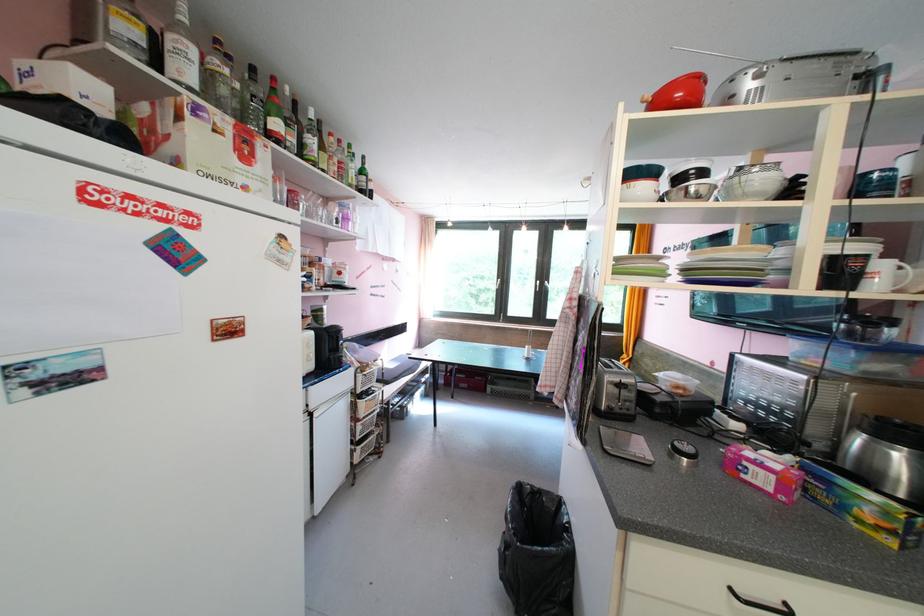
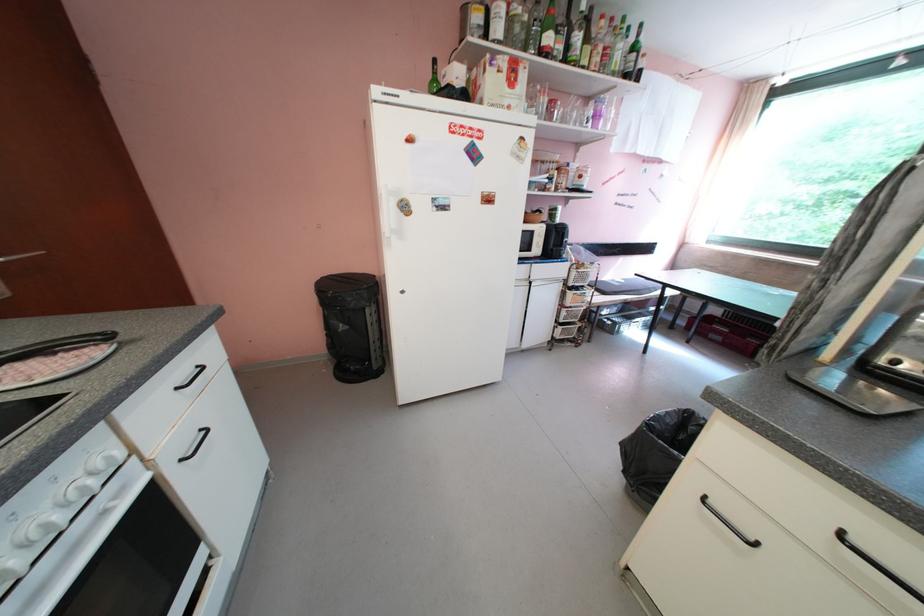
Find the pixel in the second image that matches pixel 366 398 in the first image.

(576, 290)